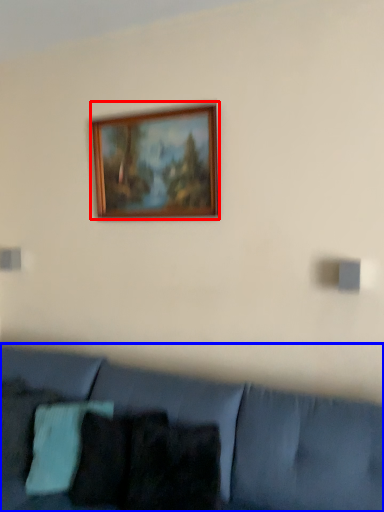
Question: Which of the following is the farthest to the observer, picture frame (highlighted by a red box) or studio couch (highlighted by a blue box)?

Choices:
 (A) picture frame
 (B) studio couch

Answer: (A)